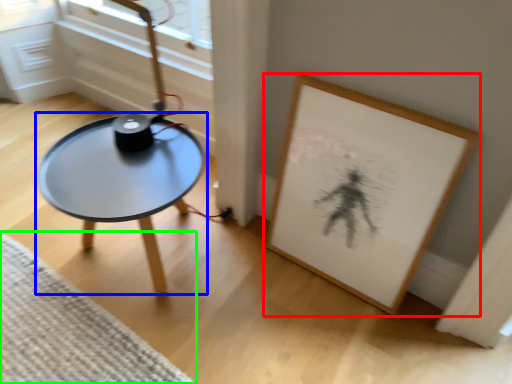
Question: Based on their relative distances, which object is farther from picture frame (highlighted by a red box)? Choose from coffee table (highlighted by a blue box) and mat (highlighted by a green box).

Choices:
 (A) coffee table
 (B) mat

Answer: (B)